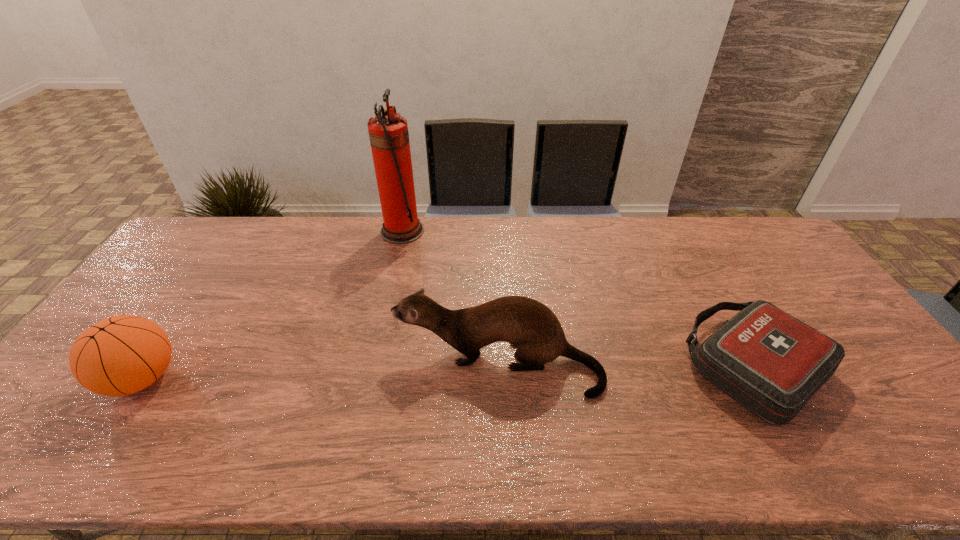
What are the coordinates of `free space at the right edge` in the screenshot? It's located at (872, 418).

In the image, there is a desktop. Where is `vacant area at the far left corner`? vacant area at the far left corner is located at coordinates (177, 251).

Where is `free space between the farthest object and the ferret`? free space between the farthest object and the ferret is located at coordinates (450, 298).

Where is `vacant space that's between the rightmost object and the tallest object`? The image size is (960, 540). vacant space that's between the rightmost object and the tallest object is located at coordinates (579, 299).

This screenshot has height=540, width=960. I want to click on empty space between the tallest object and the leftmost object, so click(273, 305).

Where is `vacant point located between the tallest object and the basketball`? vacant point located between the tallest object and the basketball is located at coordinates (273, 305).

The height and width of the screenshot is (540, 960). What are the coordinates of `free space that is in between the first-aid kit and the leftmost object` in the screenshot? It's located at (448, 372).

Find the location of a particular element. The width and height of the screenshot is (960, 540). free space between the rightmost object and the basketball is located at coordinates (448, 372).

Identify the location of unoccupied position between the ferret and the shortest object. The width and height of the screenshot is (960, 540). (627, 366).

This screenshot has height=540, width=960. In order to click on free point between the ferret and the rightmost object in this screenshot , I will do `click(627, 366)`.